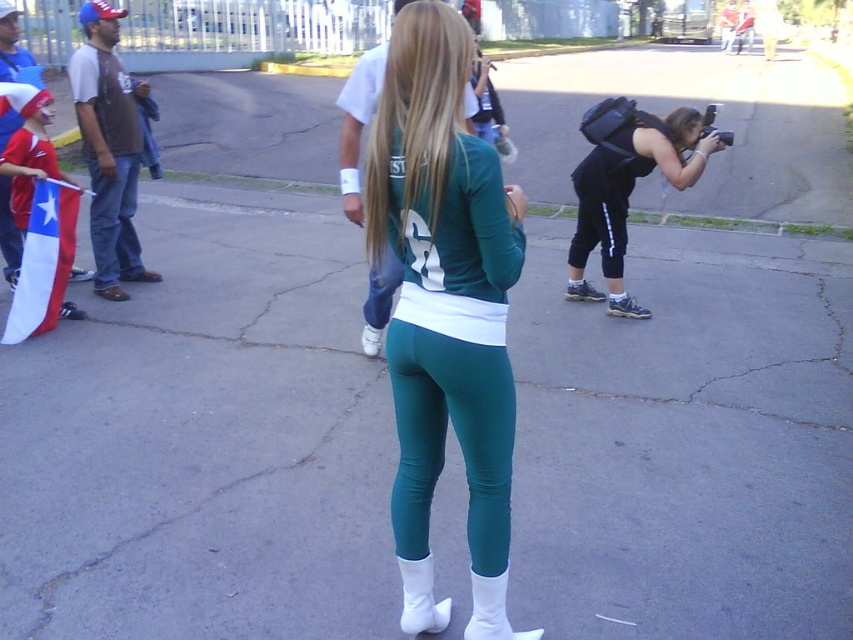
Question: Is black matte camera at center bigger than white matte boot at lower center?

Choices:
 (A) no
 (B) yes

Answer: (B)

Question: Which object is positioned closest to the black matte camera at center?

Choices:
 (A) white matte boot at lower center
 (B) white leather boot at lower center
 (C) brown leather jacket at left
 (D) tri-colored fabric flag at left

Answer: (C)

Question: Does black matte camera at center have a smaller size compared to tri-colored fabric flag at left?

Choices:
 (A) no
 (B) yes

Answer: (A)

Question: Which object is positioned farthest from the green matte leggings at center?

Choices:
 (A) white matte boot at lower center
 (B) black matte camera at center
 (C) tri-colored fabric flag at left

Answer: (B)

Question: Can you confirm if black matte camera at center is positioned to the left of white leather boot at lower center?

Choices:
 (A) yes
 (B) no

Answer: (B)

Question: Considering the real-world distances, which object is closest to the white leather boot at lower center?

Choices:
 (A) tri-colored fabric flag at left
 (B) green matte leggings at center
 (C) white matte boot at lower center
 (D) brown leather jacket at left

Answer: (C)